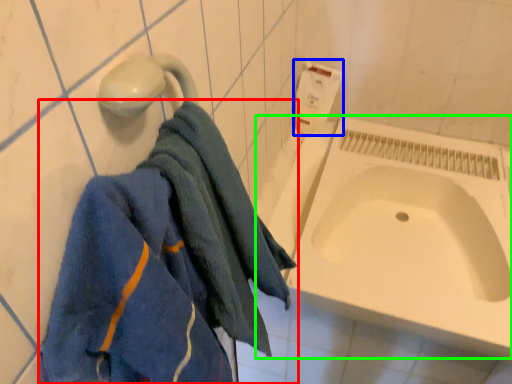
Question: Which object is the farthest from towel (highlighted by a red box)? Choose among these: toilet paper (highlighted by a blue box) or bath (highlighted by a green box).

Choices:
 (A) toilet paper
 (B) bath

Answer: (A)